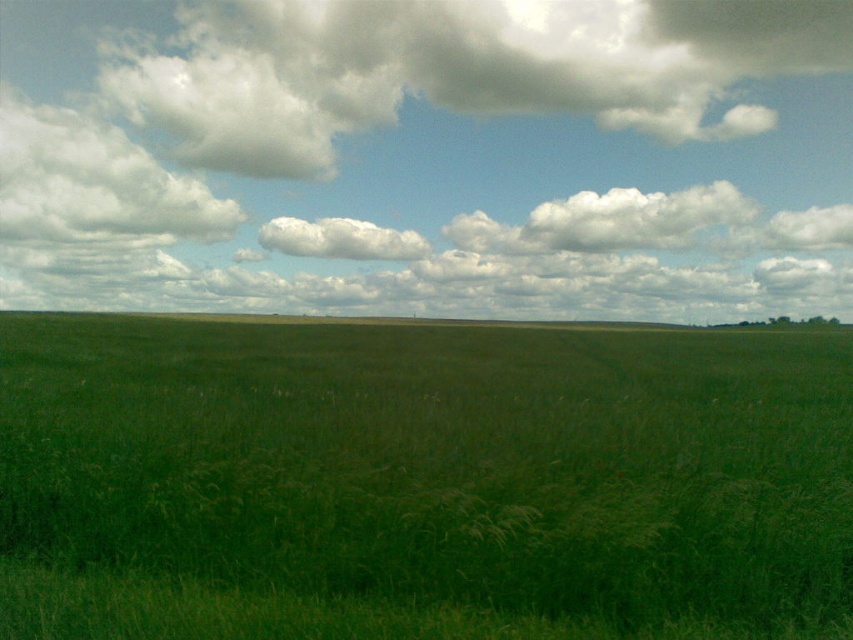
Question: Can you confirm if green grass at lower center is positioned to the right of white fluffy cloud at center?

Choices:
 (A) no
 (B) yes

Answer: (B)

Question: Is green grassy pasture at center further to the viewer compared to green grass at lower center?

Choices:
 (A) yes
 (B) no

Answer: (B)

Question: Does green grassy pasture at center have a larger size compared to white fluffy cloud at center?

Choices:
 (A) no
 (B) yes

Answer: (B)

Question: Which of these objects is positioned closest to the white fluffy cloud at center?

Choices:
 (A) green grassy pasture at center
 (B) green grass at lower center

Answer: (B)

Question: Based on their relative distances, which object is farther from the white fluffy cloud at center?

Choices:
 (A) white fluffy cloud at upper left
 (B) green grass at lower center

Answer: (A)

Question: Which object appears closest to the camera in this image?

Choices:
 (A) green grassy pasture at center
 (B) white fluffy cloud at upper left
 (C) green grass at lower center

Answer: (A)